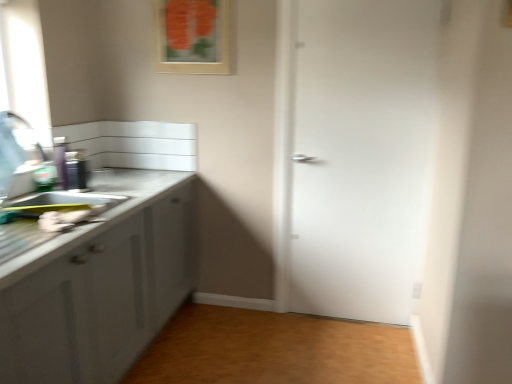
Question: Is brushed metal faucet at left turned away from matte white sink at left?

Choices:
 (A) yes
 (B) no

Answer: (B)

Question: Would you say brushed metal faucet at left contains matte white sink at left?

Choices:
 (A) no
 (B) yes

Answer: (A)

Question: Is brushed metal faucet at left next to matte white sink at left and touching it?

Choices:
 (A) yes
 (B) no

Answer: (B)

Question: From a real-world perspective, is brushed metal faucet at left positioned under matte white sink at left based on gravity?

Choices:
 (A) yes
 (B) no

Answer: (B)

Question: From a real-world perspective, is brushed metal faucet at left positioned over matte white sink at left based on gravity?

Choices:
 (A) yes
 (B) no

Answer: (A)

Question: Does brushed metal faucet at left have a lesser width compared to matte white sink at left?

Choices:
 (A) no
 (B) yes

Answer: (B)

Question: Considering the relative sizes of matte white sink at left and metallic canister at left in the image provided, is matte white sink at left bigger than metallic canister at left?

Choices:
 (A) yes
 (B) no

Answer: (A)

Question: Does matte white sink at left touch metallic canister at left?

Choices:
 (A) no
 (B) yes

Answer: (A)

Question: Is matte white sink at left positioned far away from metallic canister at left?

Choices:
 (A) no
 (B) yes

Answer: (A)

Question: Is matte white sink at left looking in the opposite direction of metallic canister at left?

Choices:
 (A) no
 (B) yes

Answer: (A)

Question: Is matte white sink at left to the right of metallic canister at left from the viewer's perspective?

Choices:
 (A) yes
 (B) no

Answer: (A)

Question: Considering the relative positions of matte white sink at left and metallic canister at left in the image provided, is matte white sink at left to the left of metallic canister at left from the viewer's perspective?

Choices:
 (A) no
 (B) yes

Answer: (A)

Question: Does metallic canister at left appear on the left side of matte white sink at left?

Choices:
 (A) no
 (B) yes

Answer: (B)